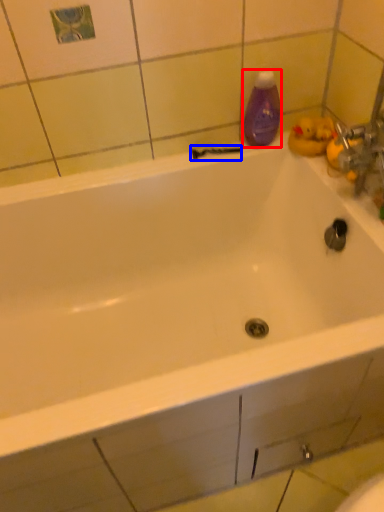
Question: Which object is closer to the camera taking this photo, cleaning product (highlighted by a red box) or shower (highlighted by a blue box)?

Choices:
 (A) cleaning product
 (B) shower

Answer: (A)